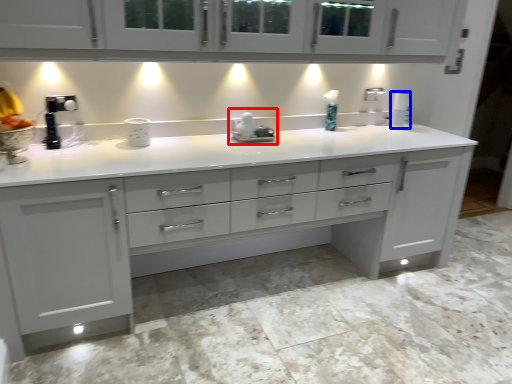
Question: Among these objects, which one is nearest to the camera, appliance (highlighted by a red box) or paper towel (highlighted by a blue box)?

Choices:
 (A) appliance
 (B) paper towel

Answer: (A)